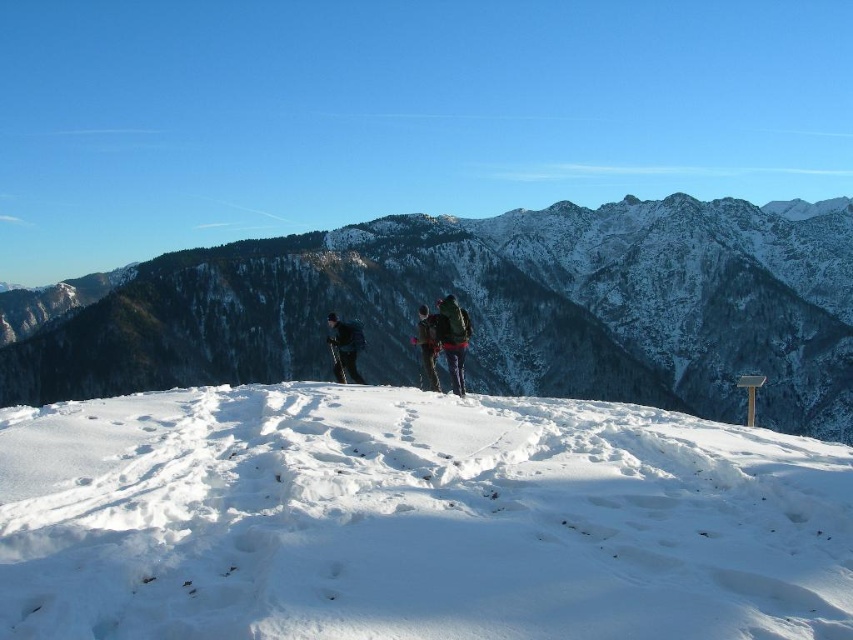
You are a hiker planning to descend from the snowy plateau where the three hikers are standing. The point marked at coordinates (497,308) indicates the snowy rocky mountain at center. Which direction should you head to avoid the steep slope?

To avoid the steep slope, you should head away from the point marked at coordinates (497,308), which is the snowy rocky mountain at center, since the steep slope is located in the middle ground descending from that area.

You are a hiker planning to descend from the snowy plateau where the three hikers are standing. You notice a point marked at coordinates (497, 308) on your map. According to the image, what does this point indicate?

The point marked at coordinates (497, 308) indicates the location of the snowy rocky mountain at center.